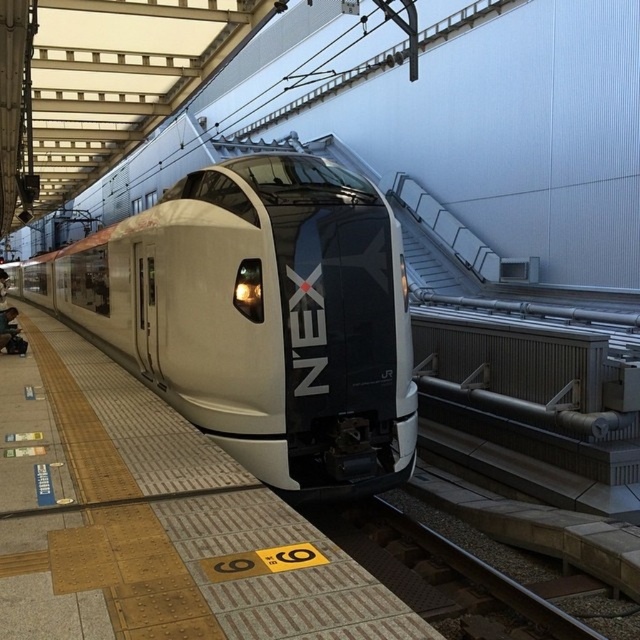
Question: Which is nearer to the smooth metal train track at center?

Choices:
 (A) smooth beige platform at center
 (B) sleek metallic train at center

Answer: (A)

Question: Considering the relative positions of sleek metallic train at center and smooth beige platform at center in the image provided, where is sleek metallic train at center located with respect to smooth beige platform at center?

Choices:
 (A) right
 (B) left

Answer: (B)

Question: Can you confirm if sleek metallic train at center is bigger than smooth metal train track at center?

Choices:
 (A) no
 (B) yes

Answer: (B)

Question: Which point appears closest to the camera in this image?

Choices:
 (A) (410, 556)
 (B) (312, 180)
 (C) (179, 515)

Answer: (C)

Question: Which point is farther from the camera taking this photo?

Choices:
 (A) tap(148, 516)
 (B) tap(355, 380)
 (C) tap(515, 611)

Answer: (B)

Question: Does sleek metallic train at center have a larger size compared to smooth beige platform at center?

Choices:
 (A) no
 (B) yes

Answer: (B)